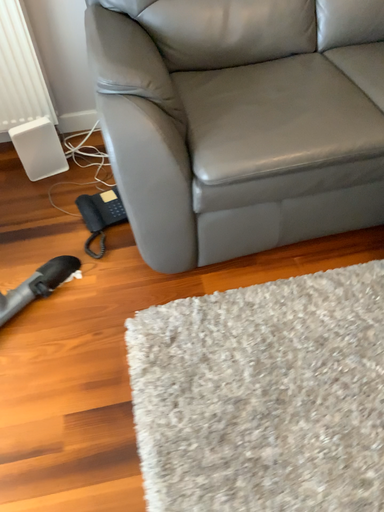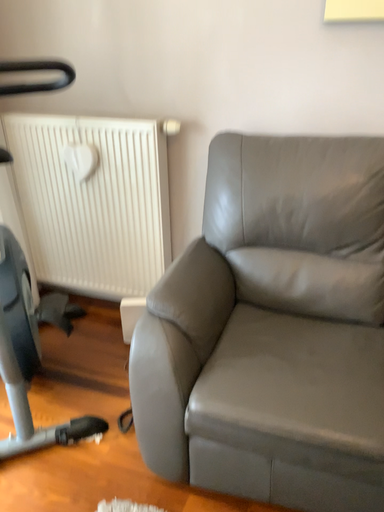
Question: How did the camera likely rotate when shooting the video?

Choices:
 (A) rotated upward
 (B) rotated downward

Answer: (A)